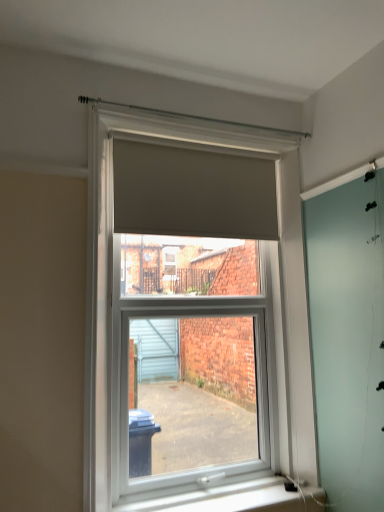
Question: From the image's perspective, is matte gray roller blind at center above white plastic window sill at lower center?

Choices:
 (A) no
 (B) yes

Answer: (B)

Question: Does matte gray roller blind at center have a larger size compared to white plastic window sill at lower center?

Choices:
 (A) yes
 (B) no

Answer: (A)

Question: Is white plastic window sill at lower center completely or partially inside matte gray roller blind at center?

Choices:
 (A) no
 (B) yes

Answer: (A)

Question: Is matte gray roller blind at center to the left of white plastic window sill at lower center from the viewer's perspective?

Choices:
 (A) yes
 (B) no

Answer: (A)

Question: From the image's perspective, is matte gray roller blind at center below white plastic window sill at lower center?

Choices:
 (A) yes
 (B) no

Answer: (B)

Question: From a real-world perspective, is matte gray roller blind at center above or below matte gray blind at upper center?

Choices:
 (A) above
 (B) below

Answer: (B)

Question: Is matte gray roller blind at center spatially inside matte gray blind at upper center, or outside of it?

Choices:
 (A) inside
 (B) outside

Answer: (B)

Question: Considering the positions of matte gray roller blind at center and matte gray blind at upper center in the image, is matte gray roller blind at center wider or thinner than matte gray blind at upper center?

Choices:
 (A) thin
 (B) wide

Answer: (B)

Question: In the image, is matte gray roller blind at center positioned in front of or behind matte gray blind at upper center?

Choices:
 (A) front
 (B) behind

Answer: (A)

Question: Considering the positions of point (135, 182) and point (102, 210), is point (135, 182) closer or farther from the camera than point (102, 210)?

Choices:
 (A) closer
 (B) farther

Answer: (B)

Question: Is matte gray blind at upper center to the left or to the right of matte gray roller blind at center in the image?

Choices:
 (A) left
 (B) right

Answer: (A)

Question: Relative to matte gray roller blind at center, is matte gray blind at upper center in front or behind?

Choices:
 (A) behind
 (B) front

Answer: (A)

Question: From a real-world perspective, is matte gray blind at upper center positioned above or below matte gray roller blind at center?

Choices:
 (A) above
 (B) below

Answer: (A)

Question: Is matte gray roller blind at center inside the boundaries of white plastic window sill at lower center, or outside?

Choices:
 (A) inside
 (B) outside

Answer: (B)

Question: From the image's perspective, relative to white plastic window sill at lower center, is matte gray roller blind at center above or below?

Choices:
 (A) below
 (B) above

Answer: (B)